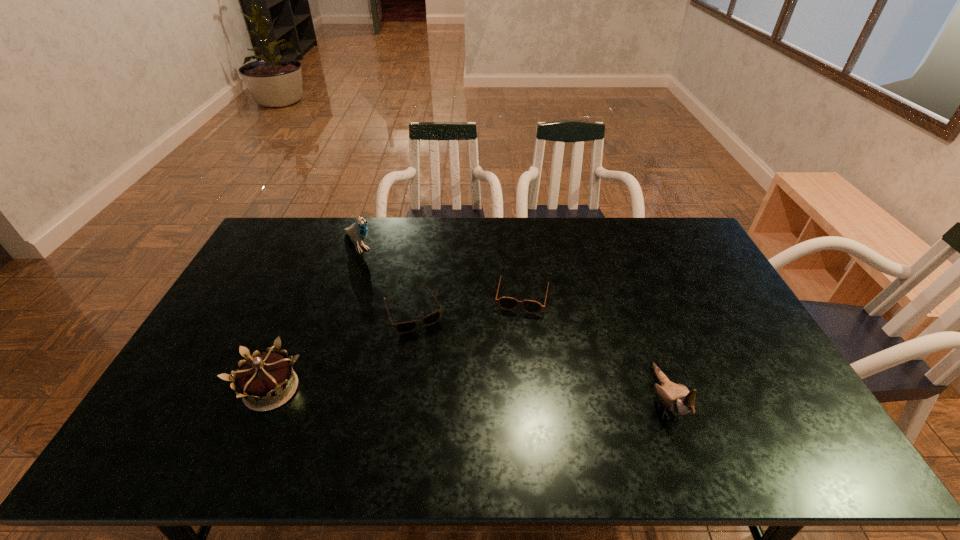
You are a GUI agent. You are given a task and a screenshot of the screen. Output one action in this format:
    pyautogui.click(x=<x>, y=<y>)
    Task: Click on the vacant space that's between the nearer bird and the farther bird
    The image size is (960, 540).
    Given the screenshot: What is the action you would take?
    pyautogui.click(x=512, y=322)

The image size is (960, 540). Find the location of `unoccupied position between the right sunglasses and the shorter sunglasses`. unoccupied position between the right sunglasses and the shorter sunglasses is located at coordinates (468, 303).

Identify the location of vacant point located between the crown and the left sunglasses. (343, 350).

Where is `free space between the nearer bird and the crown`? This screenshot has width=960, height=540. free space between the nearer bird and the crown is located at coordinates (468, 395).

The width and height of the screenshot is (960, 540). What are the coordinates of `vacant space in between the shortest object and the third shortest object` in the screenshot? It's located at (343, 350).

Where is `unoccupied area between the right bird and the crown`? unoccupied area between the right bird and the crown is located at coordinates (468, 395).

Locate an element on the screen. object that stands as the third closest to the nearer bird is located at coordinates pyautogui.click(x=261, y=380).

Locate which object ranks third in proximity to the shorter sunglasses. Please provide its 2D coordinates. Your answer should be formatted as a tuple, i.e. [(x, y)], where the tuple contains the x and y coordinates of a point satisfying the conditions above.

[(261, 380)]

Locate an element on the screen. The width and height of the screenshot is (960, 540). blank space that satisfies the following two spatial constraints: 1. on the back side of the taller sunglasses; 2. on the right side of the crown is located at coordinates (311, 295).